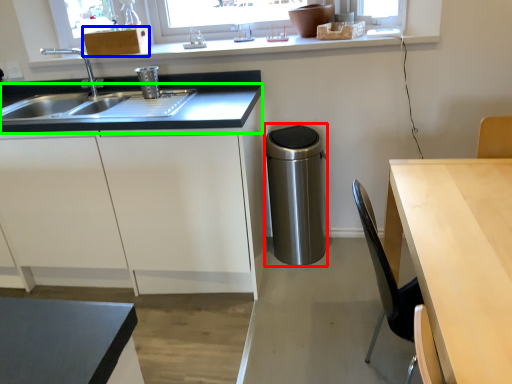
Question: Which is nearer to the appliance (highlighted by a red box)? cabinetry (highlighted by a blue box) or countertop (highlighted by a green box).

Choices:
 (A) cabinetry
 (B) countertop

Answer: (B)